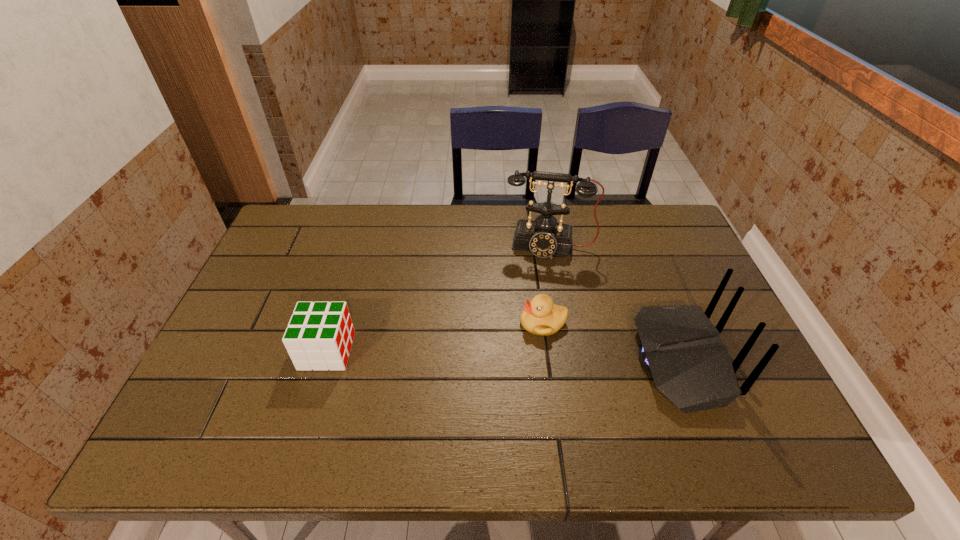
Locate an element on the screen. This screenshot has height=540, width=960. free region at the left edge of the desktop is located at coordinates (308, 269).

In the image, there is a desktop. Find the location of `free space at the right edge`. free space at the right edge is located at coordinates (657, 279).

The image size is (960, 540). In the image, there is a desktop. What are the coordinates of `vacant space at the far left corner` in the screenshot? It's located at click(318, 206).

In the image, there is a desktop. At what (x,y) coordinates should I click in order to perform the action: click on vacant space at the far right corner. Please return your answer as a coordinate pair (x, y). Looking at the image, I should click on tap(635, 223).

Locate an element on the screen. vacant area that lies between the shortest object and the farthest object is located at coordinates (546, 284).

You are a GUI agent. You are given a task and a screenshot of the screen. Output one action in this format:
    pyautogui.click(x=<x>, y=<y>)
    Task: Click on the free spot between the farthest object and the leftmost object
    Image resolution: width=960 pixels, height=540 pixels.
    Given the screenshot: What is the action you would take?
    pyautogui.click(x=438, y=298)

You are a GUI agent. You are given a task and a screenshot of the screen. Output one action in this format:
    pyautogui.click(x=<x>, y=<y>)
    Task: Click on the free spot between the router and the duckling
    The image size is (960, 540).
    Given the screenshot: What is the action you would take?
    pyautogui.click(x=612, y=341)

The height and width of the screenshot is (540, 960). What are the coordinates of `vacant space in between the router and the third tallest object` in the screenshot? It's located at (503, 356).

Where is `vacant area that lies between the farthest object and the rightmost object`? vacant area that lies between the farthest object and the rightmost object is located at coordinates (614, 303).

Where is `free point between the farthest object and the router`? The image size is (960, 540). free point between the farthest object and the router is located at coordinates (614, 303).